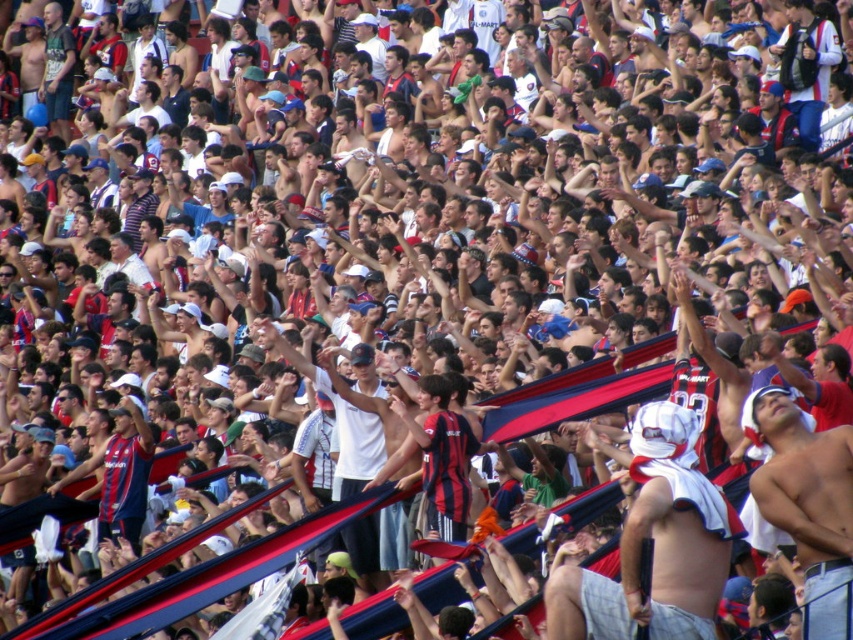
Is point (601, 620) farther from viewer compared to point (838, 454)?

No, (601, 620) is closer to viewer.

Between point (692, 561) and point (834, 637), which one is positioned behind?

Positioned behind is point (692, 561).

The height and width of the screenshot is (640, 853). Identify the location of white fabric headband at center. (654, 545).